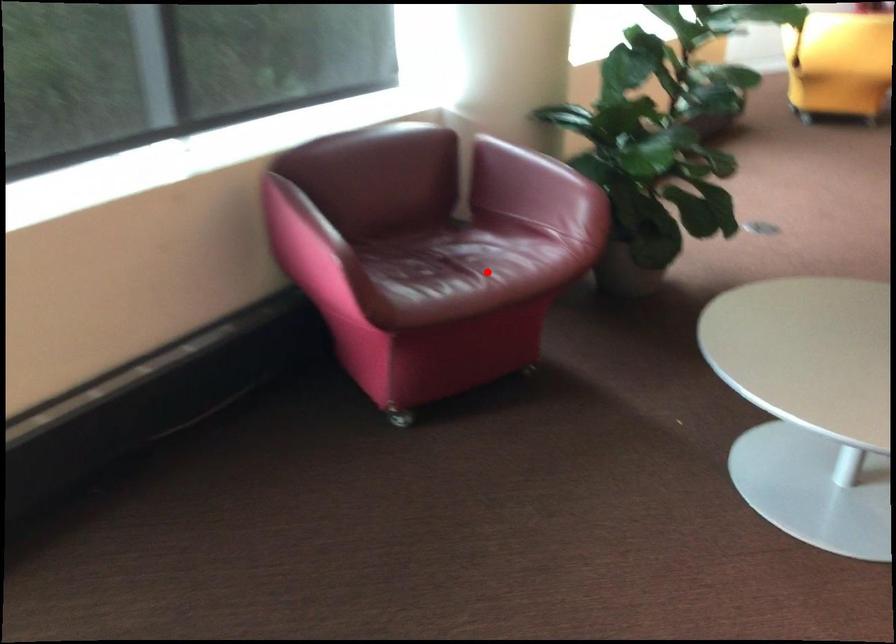
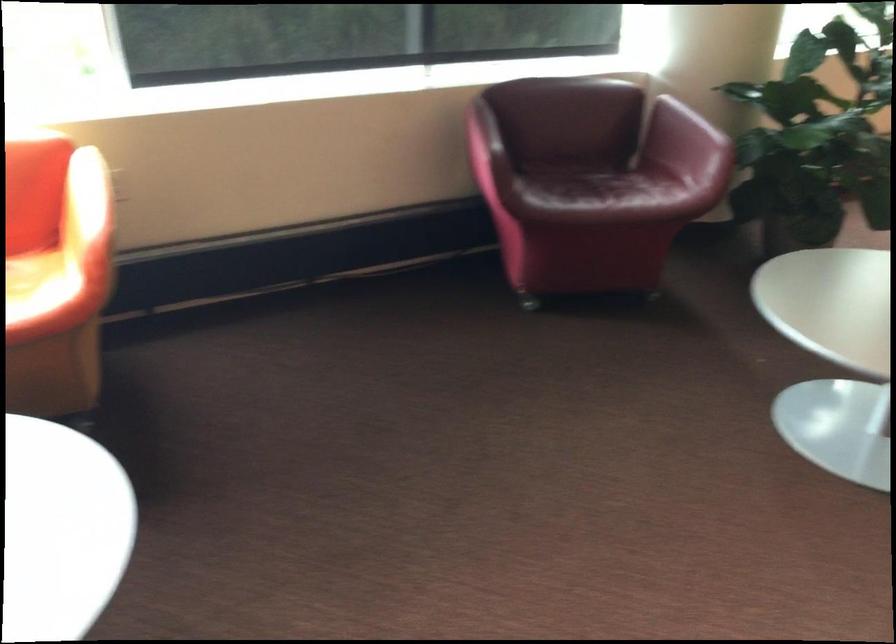
Locate, in the second image, the point that corresponds to the highlighted location in the first image.

(608, 194)